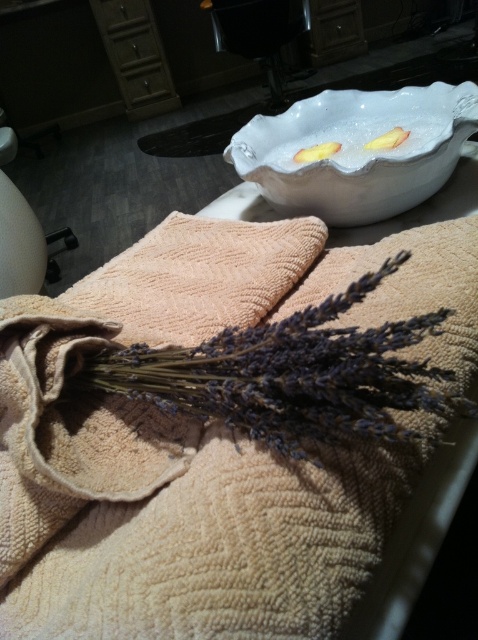
You are a therapist preparing for a client. You need to place a new set of lavender on the table so it is above the white glossy bowl at upper center. Is the current position of the dry purple lavender at center suitable?

The dry purple lavender at center is located below the white glossy bowl at upper center, so it is not above the bowl. You need to move it to a position above the bowl.